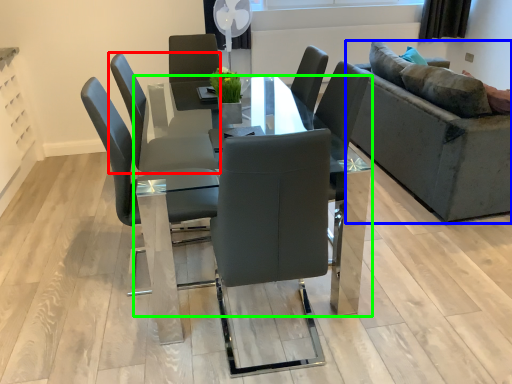
Question: Based on their relative distances, which object is nearer to chair (highlighted by a red box)? Choose from studio couch (highlighted by a blue box) and table (highlighted by a green box).

Choices:
 (A) studio couch
 (B) table

Answer: (B)